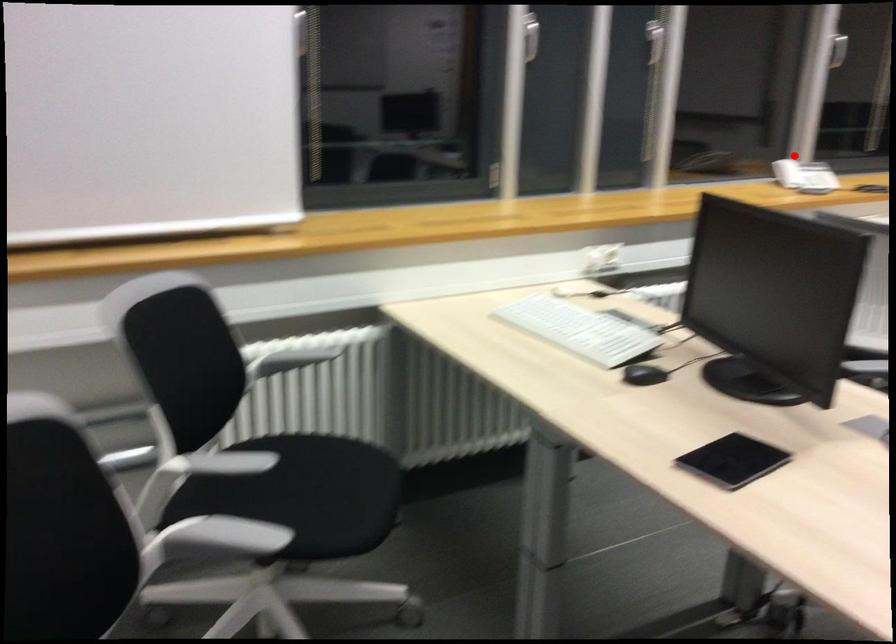
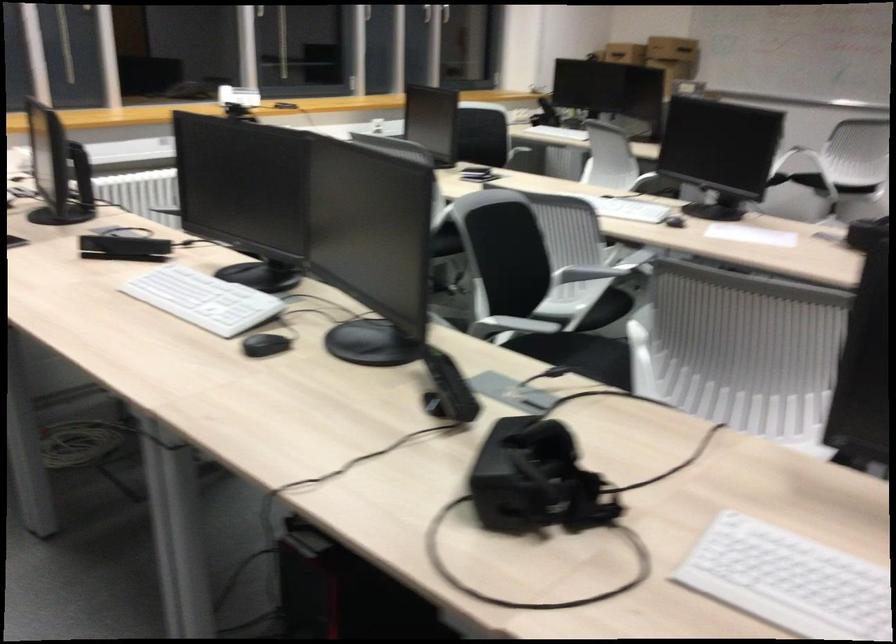
Question: A red point is marked in image1. In image2, is the corresponding 3D point closer to the camera or farther? Reply with the corresponding letter.

Choices:
 (A) The corresponding 3D point is closer.
 (B) The corresponding 3D point is farther.

Answer: (B)